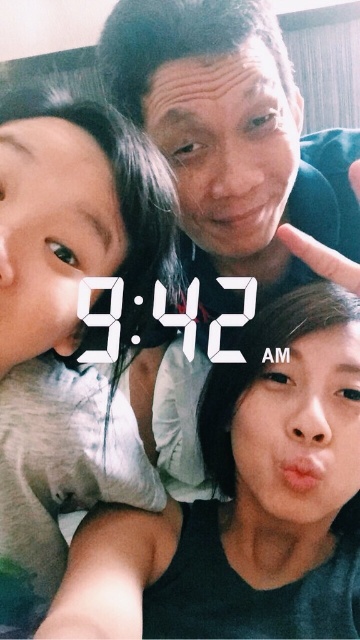
Question: Does black matte tank top at lower right appear over matte black shirt at center?

Choices:
 (A) yes
 (B) no

Answer: (B)

Question: Estimate the real-world distances between objects in this image. Which object is closer to the light beige fabric shirt at left?

Choices:
 (A) black matte tank top at lower right
 (B) matte black shirt at center

Answer: (A)

Question: Which point is closer to the camera?

Choices:
 (A) (217, 445)
 (B) (83, 112)

Answer: (B)

Question: Can you confirm if black matte tank top at lower right is positioned to the left of matte black shirt at center?

Choices:
 (A) no
 (B) yes

Answer: (B)

Question: Does light beige fabric shirt at left have a lesser width compared to matte black shirt at center?

Choices:
 (A) no
 (B) yes

Answer: (B)

Question: Among these objects, which one is nearest to the camera?

Choices:
 (A) matte black shirt at center
 (B) light beige fabric shirt at left

Answer: (B)